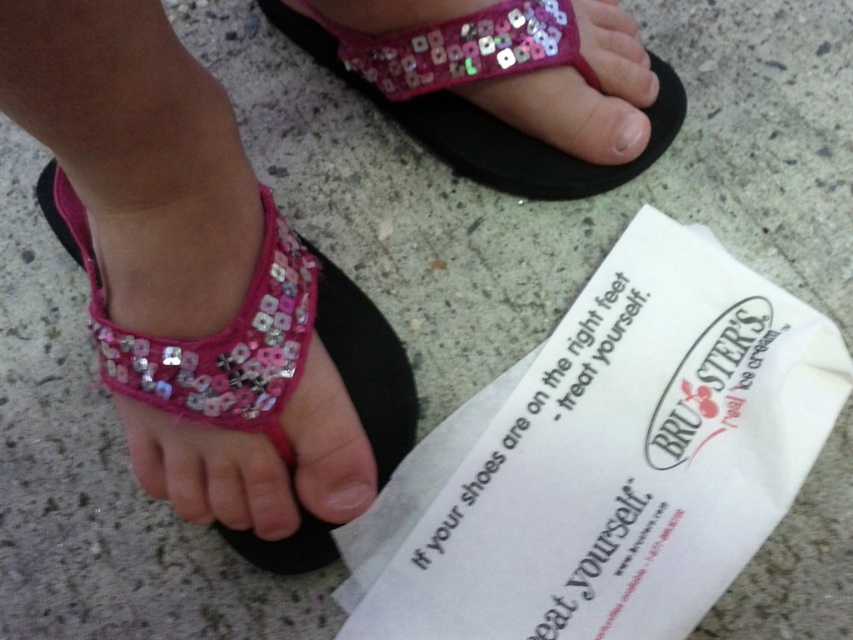
Can you confirm if pink sequined sandal at center is thinner than matte pink nail at center?

In fact, pink sequined sandal at center might be wider than matte pink nail at center.

Who is more distant from viewer, (251, 497) or (624, 145)?

Positioned behind is point (624, 145).

I want to click on pink sequined sandal at center, so click(251, 445).

Is point (469, 145) in front of point (367, 477)?

No.

Describe the element at coordinates (494, 125) in the screenshot. The image size is (853, 640). I see `pink sequined sandal at upper center` at that location.

Locate an element on the screen. pink sequined sandal at upper center is located at coordinates (494, 125).

Is point (283, 525) behind point (325, 35)?

No, (283, 525) is in front of (325, 35).

Does pink sequined sandal at center have a larger size compared to pink sequined sandal at upper center?

Incorrect, pink sequined sandal at center is not larger than pink sequined sandal at upper center.

Is point (288, 518) farther from camera compared to point (318, 49)?

No.

Where is `pink sequined sandal at center`? pink sequined sandal at center is located at coordinates (251, 445).